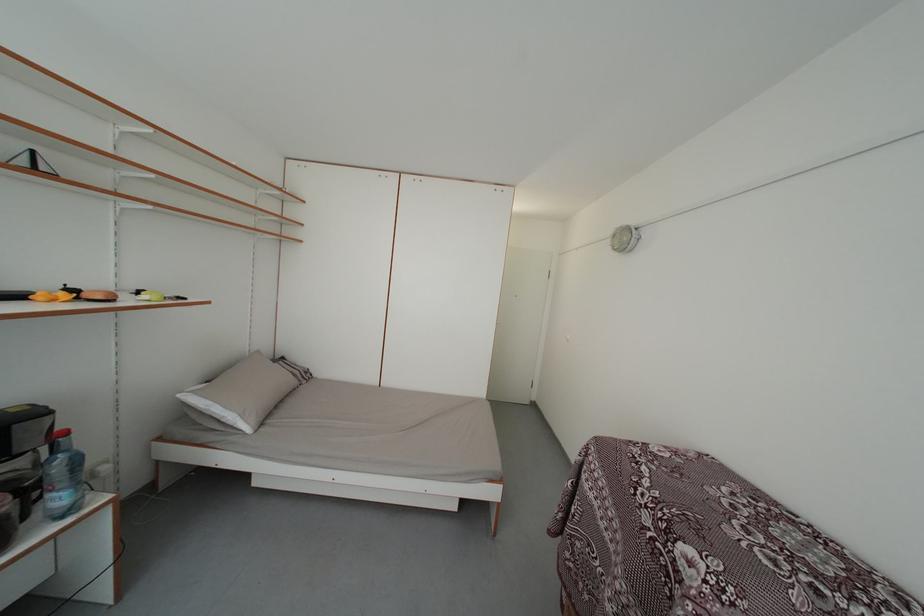
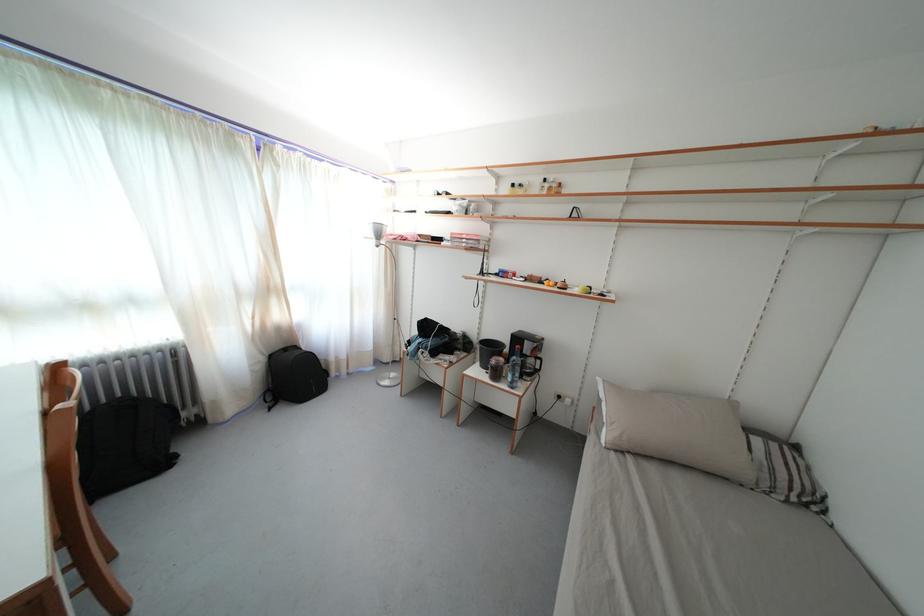
In the second image, find the point that corresponds to point (304, 379) in the first image.

(788, 482)